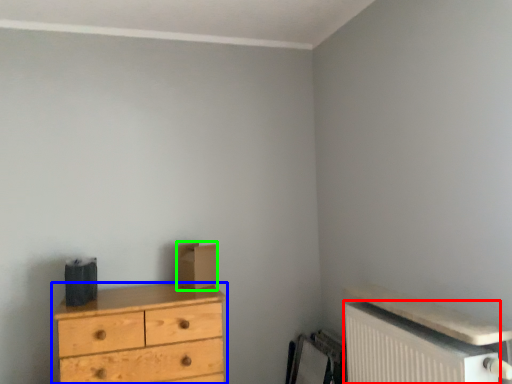
Question: Which is farther away from radiator (highlighted by a red box)? chest of drawers (highlighted by a blue box) or cardboard box (highlighted by a green box)?

Choices:
 (A) chest of drawers
 (B) cardboard box

Answer: (B)